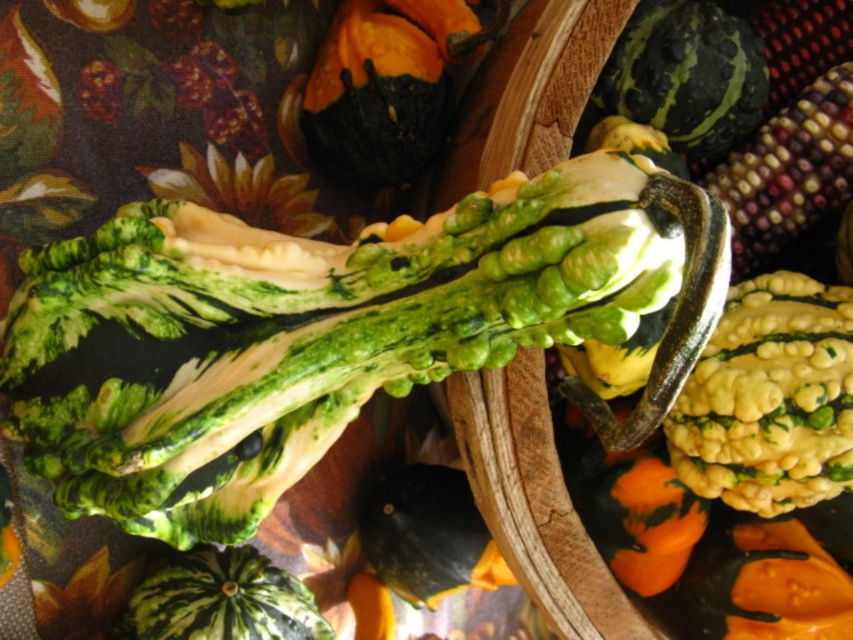
You are arranging a fall display and want to place the dark green textured gourd at upper center and the multicolored glossy corn at upper right. Which object is positioned higher in the arrangement?

The dark green textured gourd at upper center is positioned higher than the multicolored glossy corn at upper right.

You are arranging a harvest display and want to place the dark green textured gourd at upper center and the multicolored glossy corn at upper right. Which object should you place first if you want the larger item to be more prominent in the display?

You should place the dark green textured gourd at upper center first because it is larger than the multicolored glossy corn at upper right, making it more prominent in the display.

You are setting up a display and need to know the height of the objects. Which is taller between the dark green textured gourd at upper center and the multicolored glossy corn at upper right?

The multicolored glossy corn at upper right is taller than the dark green textured gourd at upper center.